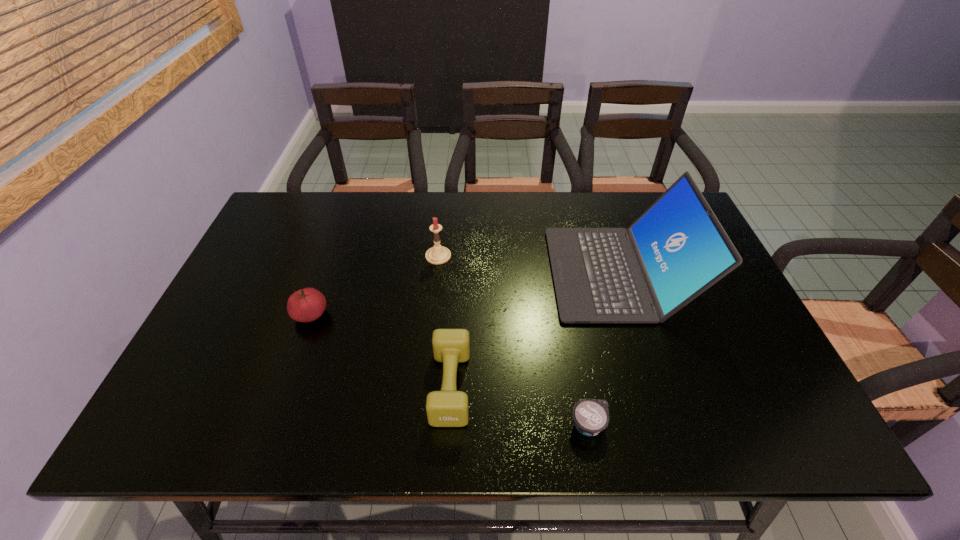
Find the location of `the tallest object`. the tallest object is located at coordinates [677, 249].

At what (x,y) coordinates should I click in order to perform the action: click on candle. Please return your answer as a coordinate pair (x, y). The height and width of the screenshot is (540, 960). Looking at the image, I should click on (438, 254).

This screenshot has width=960, height=540. What are the coordinates of `tomato` in the screenshot? It's located at (306, 305).

I want to click on dumbbell, so tap(447, 408).

Find the location of a particular element. the shortest object is located at coordinates click(x=591, y=416).

Where is `vacant position located 0.400m on the screen of the tallest object`? Image resolution: width=960 pixels, height=540 pixels. vacant position located 0.400m on the screen of the tallest object is located at coordinates (406, 273).

Find the location of `free space located on the screen of the tallest object`. free space located on the screen of the tallest object is located at coordinates (457, 273).

The height and width of the screenshot is (540, 960). I want to click on free space located on the screen of the tallest object, so click(x=497, y=273).

The image size is (960, 540). Identify the location of blank space located on the back of the second tallest object. (442, 218).

This screenshot has height=540, width=960. I want to click on free space located on the right of the tomato, so click(x=413, y=315).